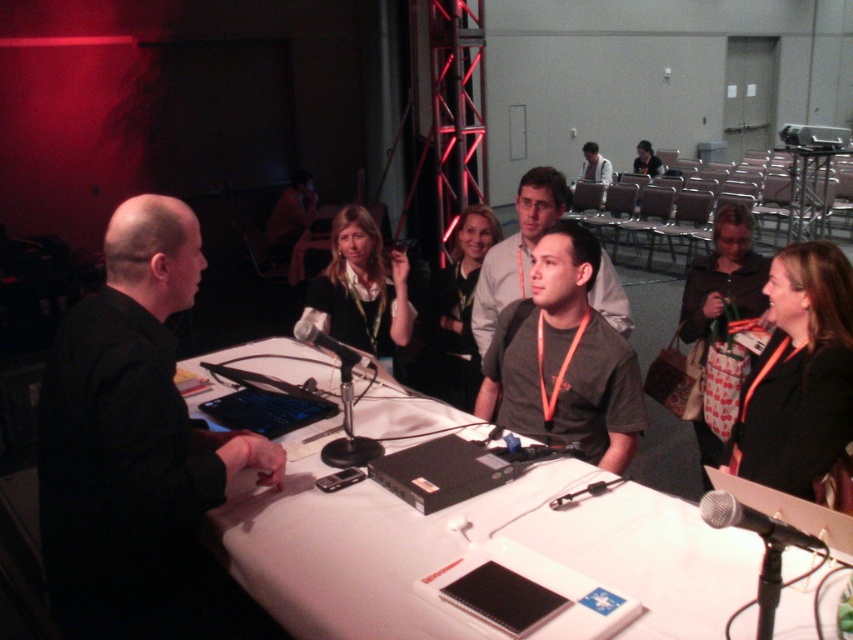
Can you confirm if white matte table at center is shorter than gray fabric shirt at center?

Correct, white matte table at center is not as tall as gray fabric shirt at center.

Is point (294, 448) more distant than point (601, 257)?

That is False.

Is point (642, 588) closer to camera compared to point (537, 209)?

Yes, point (642, 588) is in front of point (537, 209).

Identify the location of white matte table at center. The height and width of the screenshot is (640, 853). (469, 548).

Is white matte table at center thinner than dark gray t-shirt at center?

In fact, white matte table at center might be wider than dark gray t-shirt at center.

Consider the image. Who is more distant from viewer, (715, 634) or (590, 273)?

Positioned behind is point (590, 273).

Find the location of a particular element. The image size is (853, 640). white matte table at center is located at coordinates (x=469, y=548).

In order to click on white matte table at center in this screenshot , I will do `click(469, 548)`.

Does black fabric bag at center come in front of matte black shirt at center?

Yes, it is in front of matte black shirt at center.

Describe the element at coordinates (721, 323) in the screenshot. I see `black fabric bag at center` at that location.

Is point (741, 260) more distant than point (463, 298)?

That is False.

In order to click on black fabric bag at center in this screenshot , I will do `click(721, 323)`.